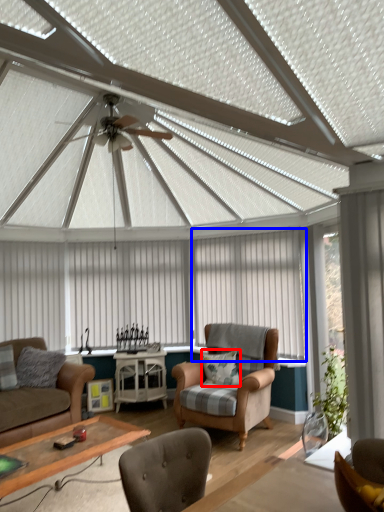
Question: Which point is further to the camera, pillow (highlighted by a red box) or curtain (highlighted by a blue box)?

Choices:
 (A) pillow
 (B) curtain

Answer: (B)